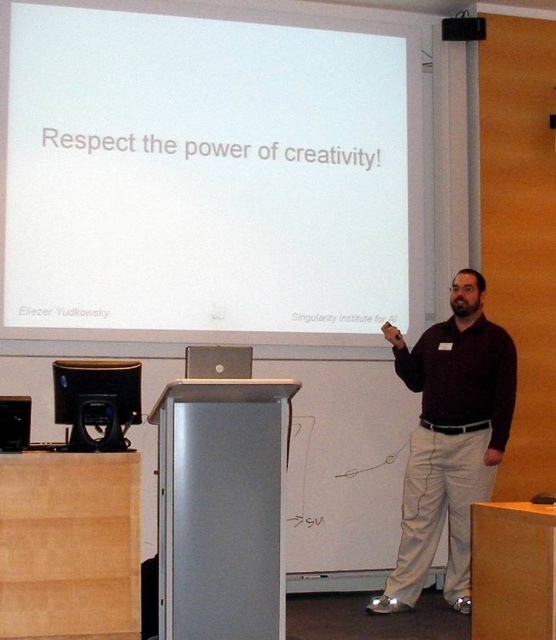
Which is in front, point (106, 291) or point (453, 26)?

Point (106, 291) is in front.

Is white matte projection screen at upper center thinner than matte black laptop at center?

No.

Measure the distance between point (43, 256) and camera.

14.84 feet

Where is `white matte projection screen at upper center`? This screenshot has width=556, height=640. white matte projection screen at upper center is located at coordinates (207, 170).

Which is in front, point (461, 461) or point (463, 38)?

Positioned in front is point (461, 461).

Can you confirm if dark brown sweater at center is positioned to the left of matte black laptop at center?

Correct, you'll find dark brown sweater at center to the left of matte black laptop at center.

Is point (444, 380) positioned before point (478, 16)?

Yes, it is in front of point (478, 16).

At what (x,y) coordinates should I click in order to perform the action: click on dark brown sweater at center. Please return your answer as a coordinate pair (x, y). This screenshot has height=640, width=556. Looking at the image, I should click on (449, 440).

Which of these two, white matte projection screen at upper center or dark brown sweater at center, stands taller?

With more height is white matte projection screen at upper center.

Does white matte projection screen at upper center have a smaller size compared to dark brown sweater at center?

No, white matte projection screen at upper center is not smaller than dark brown sweater at center.

Does point (158, 221) come behind point (418, 448)?

That is True.

Where is `white matte projection screen at upper center`? This screenshot has width=556, height=640. white matte projection screen at upper center is located at coordinates (207, 170).